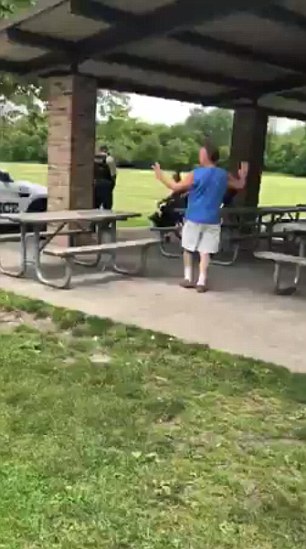
Identify the location of table. (70, 212).